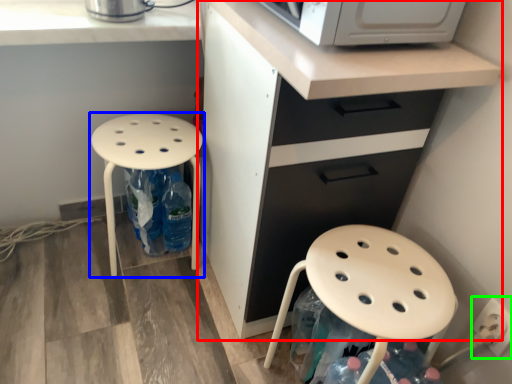
Question: Which object is the closest to the cabinetry (highlighted by a red box)? Choose among these: stool (highlighted by a blue box) or electric outlet (highlighted by a green box).

Choices:
 (A) stool
 (B) electric outlet

Answer: (A)